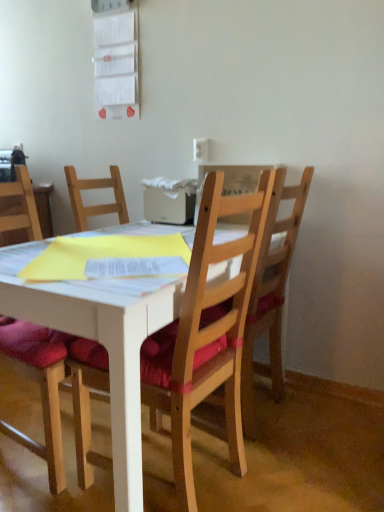
What is the approximate height of wooden chair at center, the 2th chair positioned from the right?

The height of wooden chair at center, the 2th chair positioned from the right, is 3.63 feet.

Measure the distance between point (203,153) and camera.

Point (203,153) is 2.13 meters from camera.

The width and height of the screenshot is (384, 512). What are the coordinates of `white plastic power outlet at upper center` in the screenshot? It's located at [200, 149].

Describe the element at coordinates (271, 290) in the screenshot. I see `wooden chair at right, placed as the third chair when sorted from left to right` at that location.

Image resolution: width=384 pixels, height=512 pixels. I want to click on wooden chair with red cushion at left, the 3th chair viewed from the right, so click(40, 387).

Is wooden chair with red cushion at left, placed as the 1th chair when sorted from left to right, situated inside white plastic power outlet at upper center or outside?

wooden chair with red cushion at left, placed as the 1th chair when sorted from left to right, cannot be found inside white plastic power outlet at upper center.

Is point (27, 192) farther from camera compared to point (205, 148)?

No, (27, 192) is in front of (205, 148).

From a real-world perspective, is wooden chair with red cushion at left, placed as the 1th chair when sorted from left to right, positioned over white plastic power outlet at upper center based on gravity?

No.

Relative to white plastic power outlet at upper center, is wooden chair with red cushion at left, placed as the 1th chair when sorted from left to right, in front or behind?

wooden chair with red cushion at left, placed as the 1th chair when sorted from left to right, is in front of white plastic power outlet at upper center.

Is white plastic power outlet at upper center shorter than wooden chair with red cushion at left, the 3th chair viewed from the right?

Yes.

Would you say white plastic power outlet at upper center is to the left or to the right of wooden chair with red cushion at left, the 3th chair viewed from the right, in the picture?

Clearly, white plastic power outlet at upper center is on the right of wooden chair with red cushion at left, the 3th chair viewed from the right, in the image.

Which chair is the 2nd one when counting from the front of the white plastic power outlet at upper center? Please provide its 2D coordinates.

[(40, 387)]

From a real-world perspective, is wooden chair at right, the 1th chair in the right-to-left sequence, physically below wooden chair with red cushion at left, the 3th chair viewed from the right?

Actually, wooden chair at right, the 1th chair in the right-to-left sequence, is physically above wooden chair with red cushion at left, the 3th chair viewed from the right, in the real world.

Is wooden chair at right, the 1th chair in the right-to-left sequence, oriented towards wooden chair with red cushion at left, the 3th chair viewed from the right?

No, wooden chair at right, the 1th chair in the right-to-left sequence, is not facing towards wooden chair with red cushion at left, the 3th chair viewed from the right.

Which is behind, wooden chair at right, the 1th chair in the right-to-left sequence, or wooden chair with red cushion at left, the 3th chair viewed from the right?

Positioned behind is wooden chair at right, the 1th chair in the right-to-left sequence.

Do you think wooden chair with red cushion at left, placed as the 1th chair when sorted from left to right, is within wooden chair at center, the 2th chair positioned from the right, or outside of it?

wooden chair with red cushion at left, placed as the 1th chair when sorted from left to right, is located beyond the bounds of wooden chair at center, the 2th chair positioned from the right.

From a real-world perspective, which object rests below the other?

wooden chair at center, the 2th chair positioned from the right.

Is wooden chair at center, the 2th chair positioned from the right, inside the boundaries of wooden chair with red cushion at left, the 3th chair viewed from the right, or outside?

wooden chair at center, the 2th chair positioned from the right, is spatially situated outside wooden chair with red cushion at left, the 3th chair viewed from the right.

From a real-world perspective, is wooden chair at center, the 2th chair positioned from the right, under wooden chair with red cushion at left, the 3th chair viewed from the right?

Indeed, from a real-world perspective, wooden chair at center, the 2th chair positioned from the right, is positioned beneath wooden chair with red cushion at left, the 3th chair viewed from the right.

Which of these two, wooden chair at center, the 2th chair positioned from the right, or wooden chair with red cushion at left, the 3th chair viewed from the right, is bigger?

Bigger between the two is wooden chair at center, the 2th chair positioned from the right.

From the picture: Is wooden chair at center, the 2th chair positioned from the right, positioned behind wooden chair with red cushion at left, placed as the 1th chair when sorted from left to right?

No, wooden chair at center, the 2th chair positioned from the right, is closer to the camera.

How far apart are wooden chair at center, the 2th chair positioned from the right, and white plastic power outlet at upper center?

They are 1.14 meters apart.

From the picture: Between wooden chair at center, the 2th chair positioned from the right, and white plastic power outlet at upper center, which one has larger size?

With larger size is wooden chair at center, the 2th chair positioned from the right.

Who is more distant, wooden chair at center, the 2th chair positioned from the right, or white plastic power outlet at upper center?

white plastic power outlet at upper center is more distant.

The height and width of the screenshot is (512, 384). Identify the location of power outlet that is above the wooden chair at center, the 2th chair from the left (from a real-world perspective). (x=200, y=149).

Does white plastic power outlet at upper center have a greater height compared to wooden chair at right, the 1th chair in the right-to-left sequence?

No.

Can we say white plastic power outlet at upper center lies outside wooden chair at right, placed as the third chair when sorted from left to right?

Absolutely, white plastic power outlet at upper center is external to wooden chair at right, placed as the third chair when sorted from left to right.

From a real-world perspective, relative to wooden chair at right, placed as the third chair when sorted from left to right, is white plastic power outlet at upper center vertically above or below?

Clearly, from a real-world perspective, white plastic power outlet at upper center is above wooden chair at right, placed as the third chair when sorted from left to right.

Is white plastic power outlet at upper center wider or thinner than wooden chair at right, the 1th chair in the right-to-left sequence?

A: In the image, white plastic power outlet at upper center appears to be more narrow than wooden chair at right, the 1th chair in the right-to-left sequence.

Find the location of `power outlet above the wooden chair with red cushion at left, the 3th chair viewed from the right (from the image's perspective)`. power outlet above the wooden chair with red cushion at left, the 3th chair viewed from the right (from the image's perspective) is located at coordinates (200, 149).

Locate an element on the screen. the 2nd chair below the white plastic power outlet at upper center (from a real-world perspective) is located at coordinates (40, 387).

From the image, which object appears to be nearer to wooden chair at right, the 1th chair in the right-to-left sequence, white plastic power outlet at upper center or wooden chair at center, the 2th chair positioned from the right?

wooden chair at center, the 2th chair positioned from the right, is closer to wooden chair at right, the 1th chair in the right-to-left sequence.

Based on their spatial positions, is wooden chair at right, the 1th chair in the right-to-left sequence, or white plastic power outlet at upper center closer to wooden chair with red cushion at left, the 3th chair viewed from the right?

wooden chair at right, the 1th chair in the right-to-left sequence, is closer to wooden chair with red cushion at left, the 3th chair viewed from the right.

When comparing their distances from white plastic power outlet at upper center, does wooden chair at center, the 2th chair positioned from the right, or wooden chair at right, placed as the third chair when sorted from left to right, seem closer?

wooden chair at right, placed as the third chair when sorted from left to right, is positioned closer to the anchor white plastic power outlet at upper center.

When comparing their distances from wooden chair at right, the 1th chair in the right-to-left sequence, does wooden chair at center, the 2th chair from the left, or white plastic power outlet at upper center seem closer?

wooden chair at center, the 2th chair from the left, is positioned closer to the anchor wooden chair at right, the 1th chair in the right-to-left sequence.

From the image, which object appears to be farther from wooden chair at center, the 2th chair positioned from the right, white plastic power outlet at upper center or wooden chair with red cushion at left, placed as the 1th chair when sorted from left to right?

Among the two, white plastic power outlet at upper center is located further to wooden chair at center, the 2th chair positioned from the right.

From the picture: Which object lies further to the anchor point white plastic power outlet at upper center, wooden chair at center, the 2th chair positioned from the right, or wooden chair with red cushion at left, the 3th chair viewed from the right?

Based on the image, wooden chair with red cushion at left, the 3th chair viewed from the right, appears to be further to white plastic power outlet at upper center.

Based on their spatial positions, is wooden chair at right, placed as the third chair when sorted from left to right, or wooden chair with red cushion at left, placed as the 1th chair when sorted from left to right, closer to wooden chair at center, the 2th chair from the left?

Among the two, wooden chair at right, placed as the third chair when sorted from left to right, is located nearer to wooden chair at center, the 2th chair from the left.

Considering their positions, is white plastic power outlet at upper center positioned further to wooden chair at center, the 2th chair from the left, than wooden chair at right, placed as the third chair when sorted from left to right?

white plastic power outlet at upper center is positioned further to the anchor wooden chair at center, the 2th chair from the left.

Identify the location of chair located between wooden chair with red cushion at left, placed as the 1th chair when sorted from left to right, and white plastic power outlet at upper center in the depth direction. The height and width of the screenshot is (512, 384). pyautogui.click(x=271, y=290).

Find the location of a particular element. The height and width of the screenshot is (512, 384). chair between wooden chair with red cushion at left, placed as the 1th chair when sorted from left to right, and wooden chair at right, the 1th chair in the right-to-left sequence, in the horizontal direction is located at coordinates (206, 332).